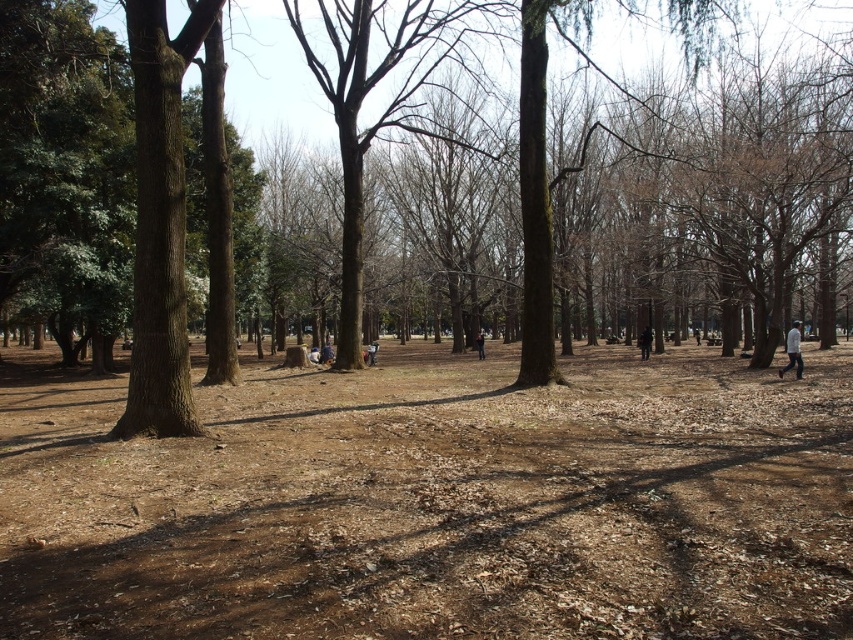
Question: Is brown/dry soil at center behind white cotton shirt at right?

Choices:
 (A) no
 (B) yes

Answer: (A)

Question: Which point is closer to the camera?

Choices:
 (A) brown textured tree at center
 (B) brown/dry soil at center
 (C) dark brown leather jacket at center

Answer: (B)

Question: Which object is positioned closest to the dark brown leather jacket at center?

Choices:
 (A) brown textured tree at center
 (B) white cotton shirt at right
 (C) dark blue jeans at center

Answer: (B)

Question: Is brown/dry soil at center below dark blue jeans at center?

Choices:
 (A) no
 (B) yes

Answer: (B)

Question: Considering the real-world distances, which object is closest to the dark brown leather jacket at center?

Choices:
 (A) white cotton shirt at right
 (B) dark blue jeans at center
 (C) brown/dry soil at center
 (D) brown textured tree at center

Answer: (A)

Question: Considering the relative positions of brown/dry soil at center and dark brown leather jacket at center in the image provided, where is brown/dry soil at center located with respect to dark brown leather jacket at center?

Choices:
 (A) below
 (B) above

Answer: (A)